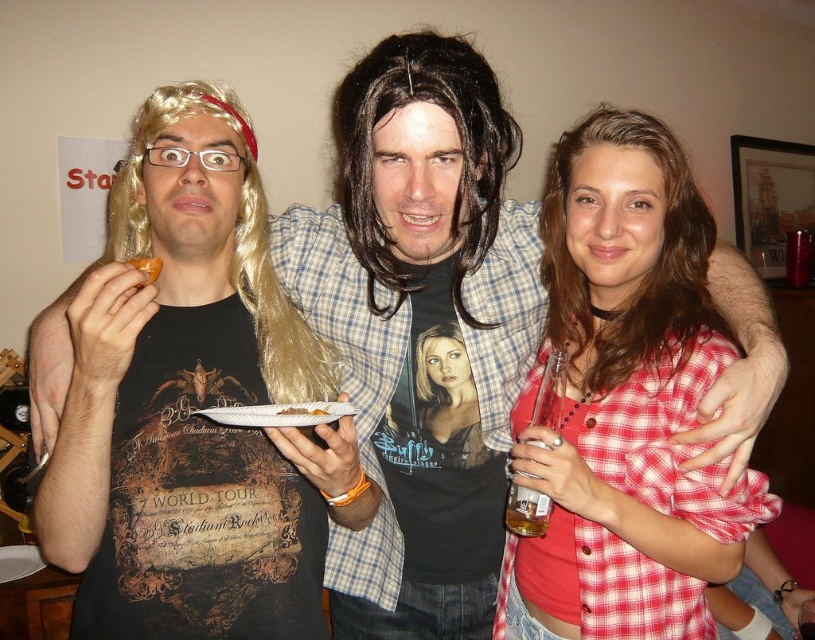
Does point (425, 388) come closer to viewer compared to point (316, 422)?

That is False.

Between smooth black fabric at center and white paper plate at center, which one appears on the left side from the viewer's perspective?

Positioned to the left is white paper plate at center.

Which is behind, point (437, 433) or point (347, 416)?

The point (437, 433) is behind.

What are the coordinates of `smooth black fabric at center` in the screenshot? It's located at click(446, 396).

Who is positioned more to the right, white paper plate at center or orange flesh at center?

white paper plate at center is more to the right.

Does point (329, 417) lie behind point (156, 275)?

No, it is in front of (156, 275).

Does point (302, 406) lie in front of point (133, 262)?

Yes, point (302, 406) is closer to viewer.

Image resolution: width=815 pixels, height=640 pixels. Find the location of `white paper plate at center`. white paper plate at center is located at coordinates (278, 413).

Between smooth black fabric at center and orange flesh at center, which one appears on the left side from the viewer's perspective?

Positioned to the left is orange flesh at center.

Locate an element on the screen. The width and height of the screenshot is (815, 640). smooth black fabric at center is located at coordinates (446, 396).